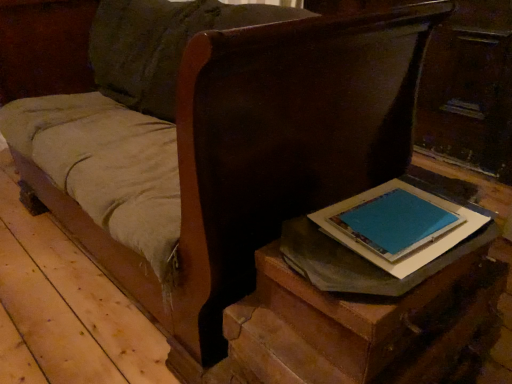
Question: Relative to blue paper at right, is matte brown table at lower right in front or behind?

Choices:
 (A) behind
 (B) front

Answer: (B)

Question: Considering the positions of matte brown table at lower right and blue paper at right in the image, is matte brown table at lower right taller or shorter than blue paper at right?

Choices:
 (A) tall
 (B) short

Answer: (A)

Question: Is matte brown table at lower right inside or outside of blue paper at right?

Choices:
 (A) outside
 (B) inside

Answer: (A)

Question: In terms of height, does blue paper at right look taller or shorter compared to matte brown table at lower right?

Choices:
 (A) tall
 (B) short

Answer: (B)

Question: In terms of width, does blue paper at right look wider or thinner when compared to matte brown table at lower right?

Choices:
 (A) thin
 (B) wide

Answer: (A)

Question: From a real-world perspective, is blue paper at right above or below matte brown table at lower right?

Choices:
 (A) below
 (B) above

Answer: (B)

Question: Is blue paper at right to the left or to the right of matte brown table at lower right in the image?

Choices:
 (A) right
 (B) left

Answer: (A)